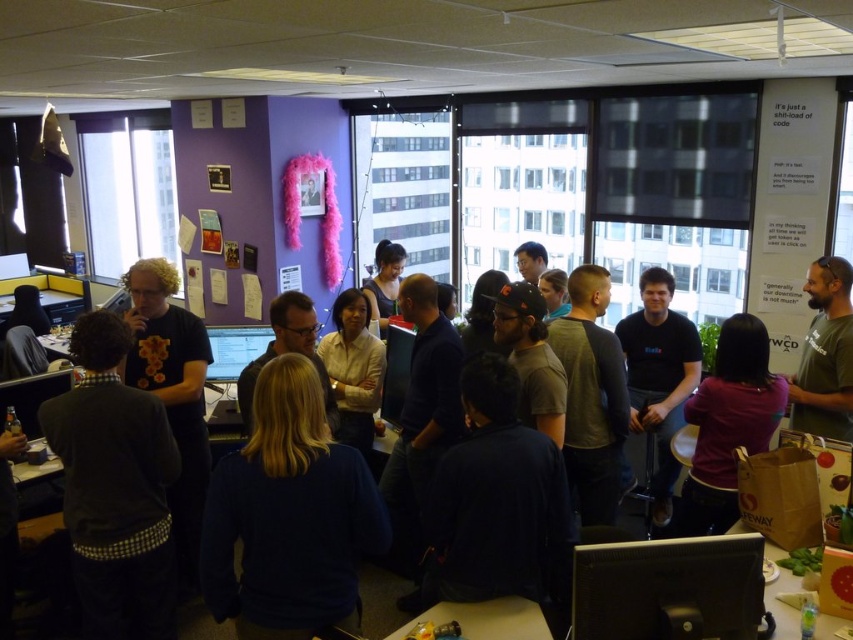
Question: Among these objects, which one is nearest to the camera?

Choices:
 (A) dark gray sweater at lower left
 (B) black matte shirt at center
 (C) purple matte shirt at center
 (D) matte black monitor at center

Answer: (A)

Question: Considering the relative positions of black glossy monitor at lower right and matte black monitor at center in the image provided, where is black glossy monitor at lower right located with respect to matte black monitor at center?

Choices:
 (A) right
 (B) left

Answer: (A)

Question: Among these objects, which one is nearest to the camera?

Choices:
 (A) matte black monitor at center
 (B) purple matte shirt at center

Answer: (B)

Question: Estimate the real-world distances between objects in this image. Which object is closer to the matte black monitor at center?

Choices:
 (A) purple matte shirt at center
 (B) dark gray sweater at lower left
 (C) black glossy monitor at lower right

Answer: (B)

Question: Is black glossy monitor at lower right above black matte shirt at center?

Choices:
 (A) no
 (B) yes

Answer: (A)

Question: Can you confirm if dark gray sweater at lower left is bigger than purple matte shirt at center?

Choices:
 (A) no
 (B) yes

Answer: (A)